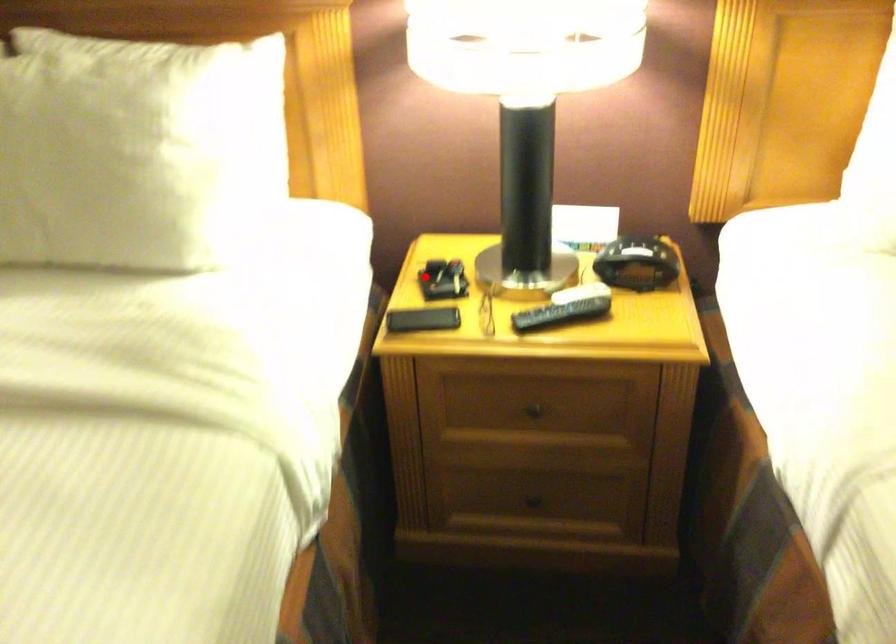
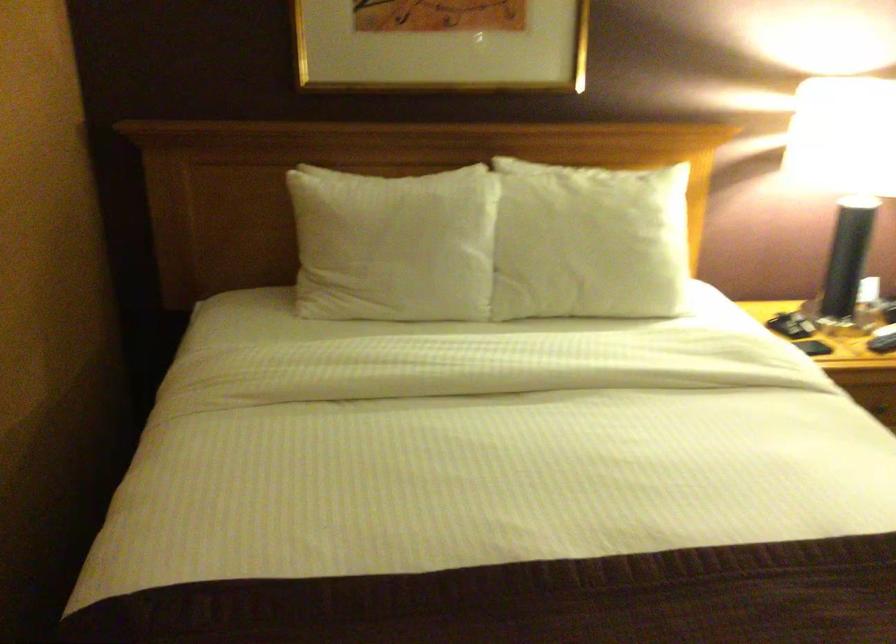
Question: I am providing you with two images of the same scene from different viewpoints. Image1 has a red point marked. In image2, the corresponding 3D location appears at what relative position? Reply with the corresponding letter.

Choices:
 (A) Closer
 (B) Farther

Answer: (B)